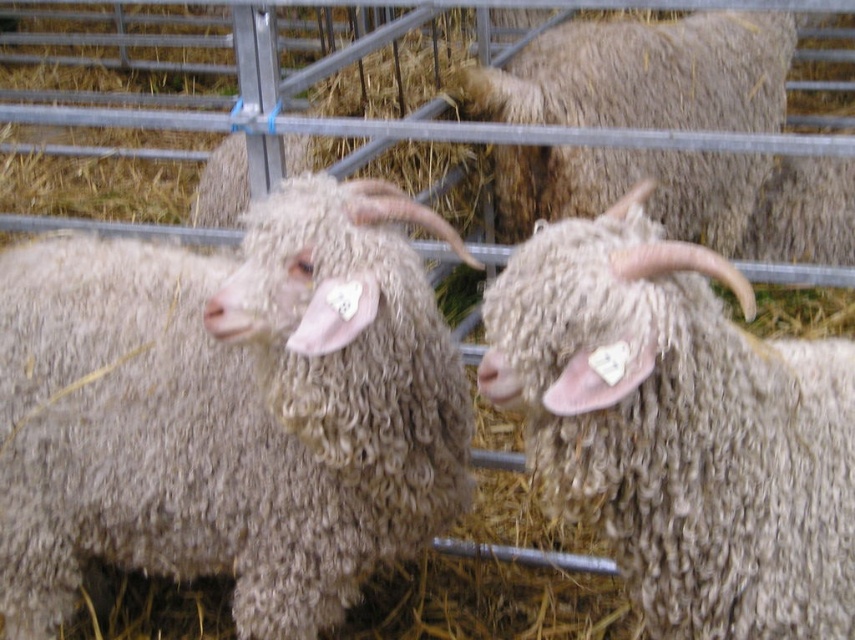
You are a farmer checking the sheep in the pen. You notice two sheep at the center of the pen. Which one is positioned lower down between the curly woolen sheep at center and the fuzzy woolen sheep at center?

The curly woolen sheep at center is located below the fuzzy woolen sheep at center, so the curly woolen sheep at center is positioned lower down.

You are standing at the origin point of the coordinate system in the image. You want to walk directly to the curly woolen sheep at center. What direction should you head in?

Since the curly woolen sheep at center is located at coordinate point (x=228, y=410), you should head in the direction of positive x and positive y axes to reach it.